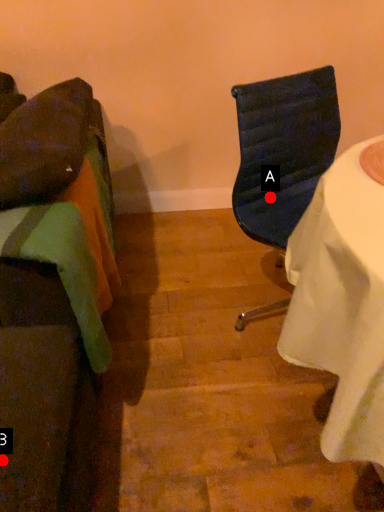
Question: Two points are circled on the image, labeled by A and B beside each circle. Which point appears farthest from the camera in this image?

Choices:
 (A) A is further
 (B) B is further

Answer: (A)